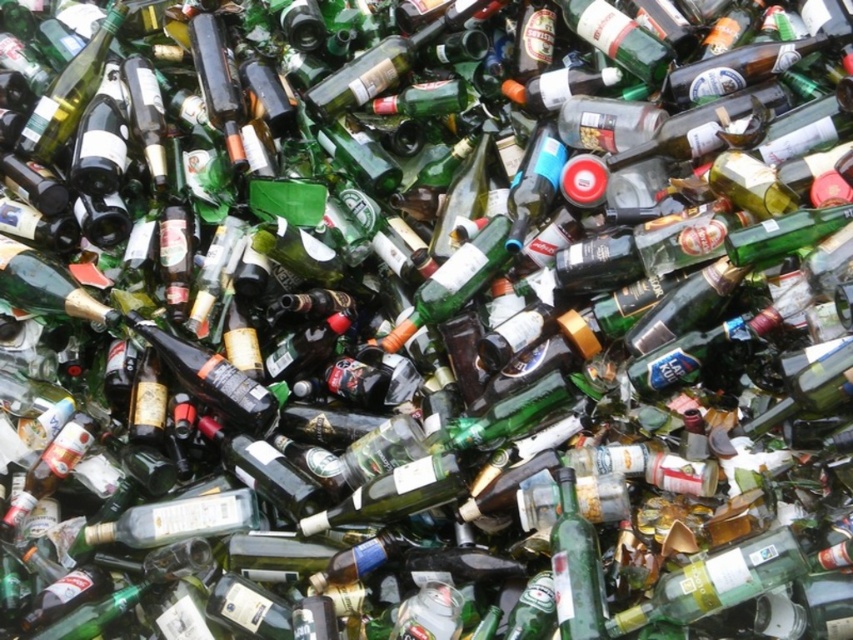
Question: Is green glass bottle at center below matte black bottle at center?

Choices:
 (A) yes
 (B) no

Answer: (A)

Question: Among these objects, which one is farthest from the camera?

Choices:
 (A) green glass bottle at center
 (B) matte black bottle at center

Answer: (B)

Question: Which of the following is the farthest from the observer?

Choices:
 (A) (561, 584)
 (B) (263, 426)

Answer: (B)

Question: In this image, where is green glass bottle at center located relative to matte black bottle at center?

Choices:
 (A) right
 (B) left

Answer: (A)

Question: Where is green glass bottle at center located in relation to matte black bottle at center in the image?

Choices:
 (A) right
 (B) left

Answer: (A)